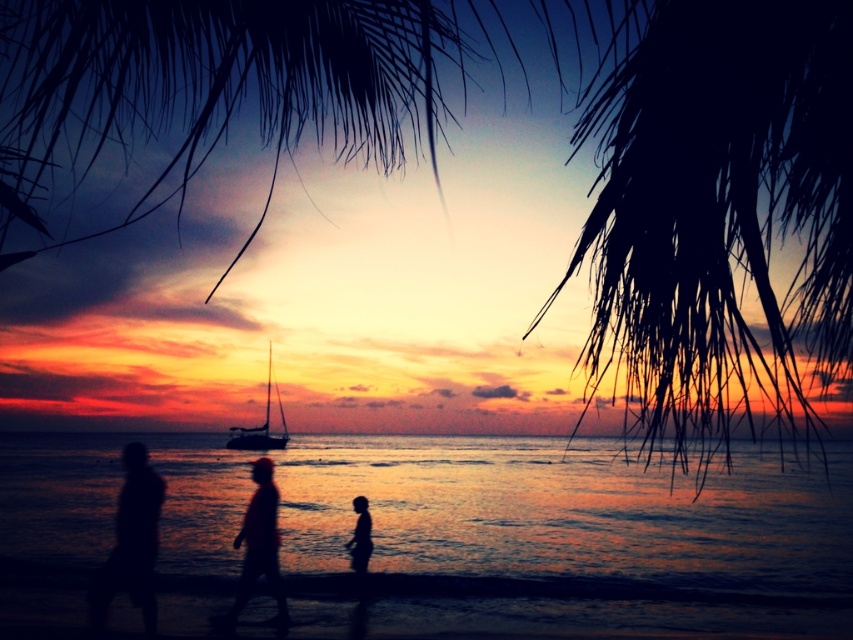
Question: Among these objects, which one is farthest from the camera?

Choices:
 (A) silhouette figure at center
 (B) dark sand at lower center

Answer: (A)

Question: Which object appears farthest from the camera in this image?

Choices:
 (A) silhouette figure at center
 (B) silhouette figure at lower left
 (C) silky black palm fronds at upper right

Answer: (B)

Question: Does dark sand at lower center have a lesser width compared to silhouette figure at center?

Choices:
 (A) yes
 (B) no

Answer: (B)

Question: Can you confirm if silky black palm fronds at upper right is positioned below silhouette figure at center?

Choices:
 (A) yes
 (B) no

Answer: (B)

Question: Among these objects, which one is farthest from the camera?

Choices:
 (A) silhouette figure at center
 (B) shiny reflective water at center
 (C) silhouette figure at lower left

Answer: (C)

Question: Is silky black palm fronds at upper right wider than silhouette figure at center?

Choices:
 (A) yes
 (B) no

Answer: (A)